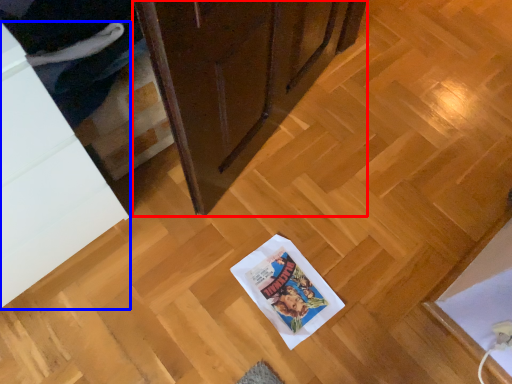
Question: Which object is further to the camera taking this photo, cabinetry (highlighted by a red box) or cabinetry (highlighted by a blue box)?

Choices:
 (A) cabinetry
 (B) cabinetry

Answer: (A)